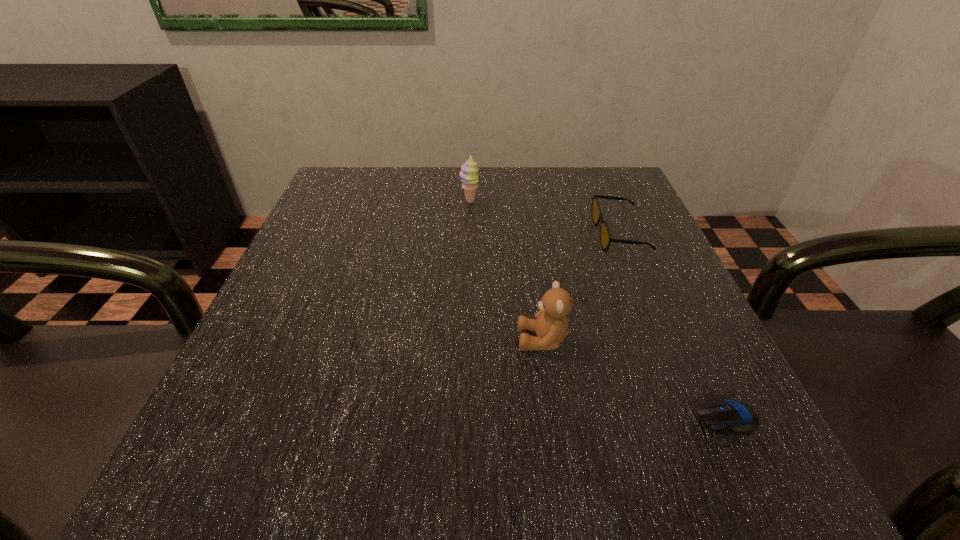
This screenshot has width=960, height=540. What are the coordinates of `object that is at the near edge` in the screenshot? It's located at (718, 413).

Locate an element on the screen. Image resolution: width=960 pixels, height=540 pixels. sunglasses located at the right edge is located at coordinates (605, 236).

The height and width of the screenshot is (540, 960). Find the location of `computer mouse that is at the right edge`. computer mouse that is at the right edge is located at coordinates (718, 413).

In order to click on object present at the far right corner in this screenshot , I will do pos(605,236).

Identify the location of object present at the near right corner. The height and width of the screenshot is (540, 960). (718, 413).

Where is `free space at the far edge of the desktop`? The image size is (960, 540). free space at the far edge of the desktop is located at coordinates (505, 166).

The image size is (960, 540). I want to click on vacant area at the near edge, so click(607, 495).

The image size is (960, 540). I want to click on vacant space at the left edge, so click(281, 307).

In the image, there is a desktop. At what (x,y) coordinates should I click in order to perform the action: click on vacant space at the right edge. Please return your answer as a coordinate pair (x, y). This screenshot has width=960, height=540. Looking at the image, I should click on (620, 287).

In the image, there is a desktop. Find the location of `vacant space at the far left corner`. vacant space at the far left corner is located at coordinates tap(336, 199).